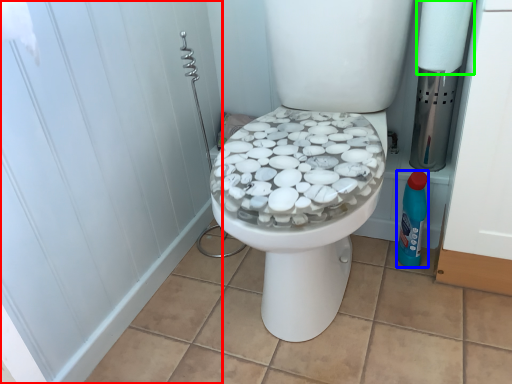
Question: Which object is the closest to the screen door (highlighted by a red box)? Choose among these: cleaning product (highlighted by a blue box) or toilet paper (highlighted by a green box).

Choices:
 (A) cleaning product
 (B) toilet paper

Answer: (A)